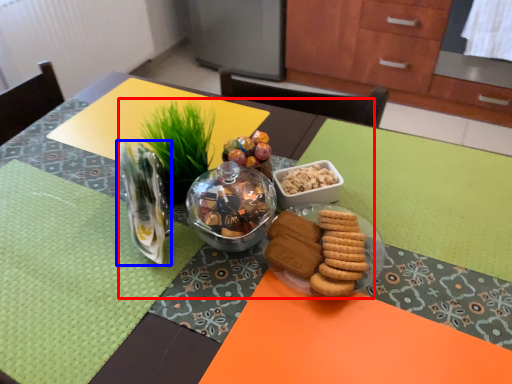
Question: Which object appears closest to the camera in this image, meal (highlighted by a red box) or tableware (highlighted by a blue box)?

Choices:
 (A) meal
 (B) tableware

Answer: (B)